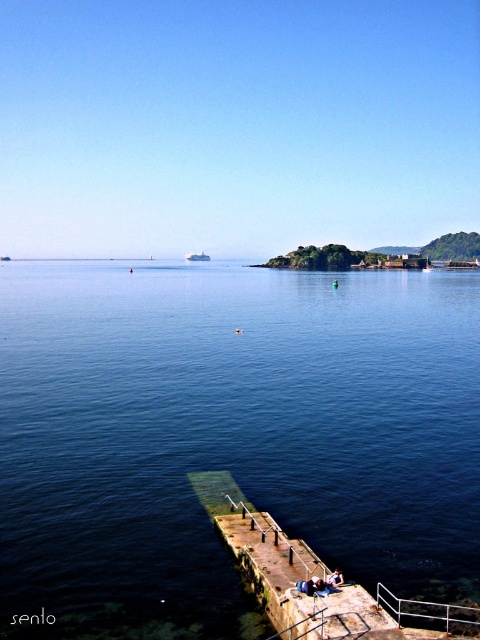
Who is shorter, white metal rail at lower right or denim jacket at lower center?

denim jacket at lower center is shorter.

Can you confirm if white metal rail at lower right is positioned below denim jacket at lower center?

Correct, white metal rail at lower right is located below denim jacket at lower center.

Who is more distant from viewer, (428,604) or (334,572)?

Positioned behind is point (334,572).

This screenshot has width=480, height=640. I want to click on white metal rail at lower right, so pos(429,611).

Between blue water at center and blue denim jeans at lower center, which one has more height?

blue water at center

Which is in front, point (193, 406) or point (303, 582)?

Point (303, 582) is in front.

Is point (384, 332) positioned before point (297, 582)?

No, (384, 332) is behind (297, 582).

Where is `blue water at center`? The height and width of the screenshot is (640, 480). blue water at center is located at coordinates (230, 435).

Is white metal rail at lower right bigger than blue denim jeans at lower center?

Correct, white metal rail at lower right is larger in size than blue denim jeans at lower center.

Measure the distance between white metal rail at lower right and blue denim jeans at lower center.

The distance of white metal rail at lower right from blue denim jeans at lower center is 5.89 feet.

Describe the element at coordinates (429, 611) in the screenshot. The image size is (480, 640). I see `white metal rail at lower right` at that location.

Image resolution: width=480 pixels, height=640 pixels. I want to click on white metal rail at lower right, so click(x=429, y=611).